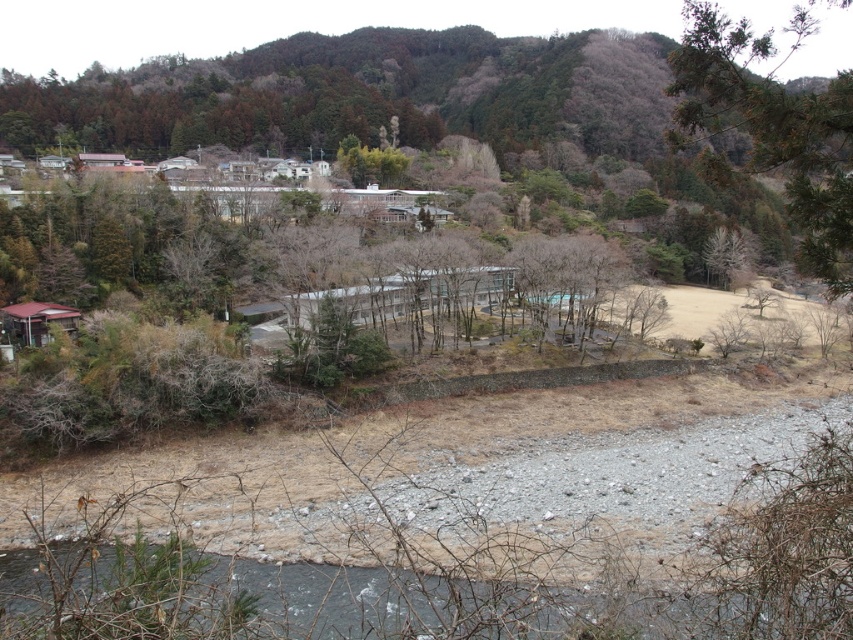
You are an artist sketching the rural landscape scene. You want to add a pine branch in your drawing. Based on the scene, where should you place the green textured pine branch at upper right?

The green textured pine branch at upper right should be placed at the 2D coordinates point (772, 131).

You are standing at the point marked as point (358, 600) in the image. Based on the scene description, what type of terrain are you currently on?

The point (358, 600) corresponds to the gray gravel river at lower center, so you are standing on a gravel river terrain.